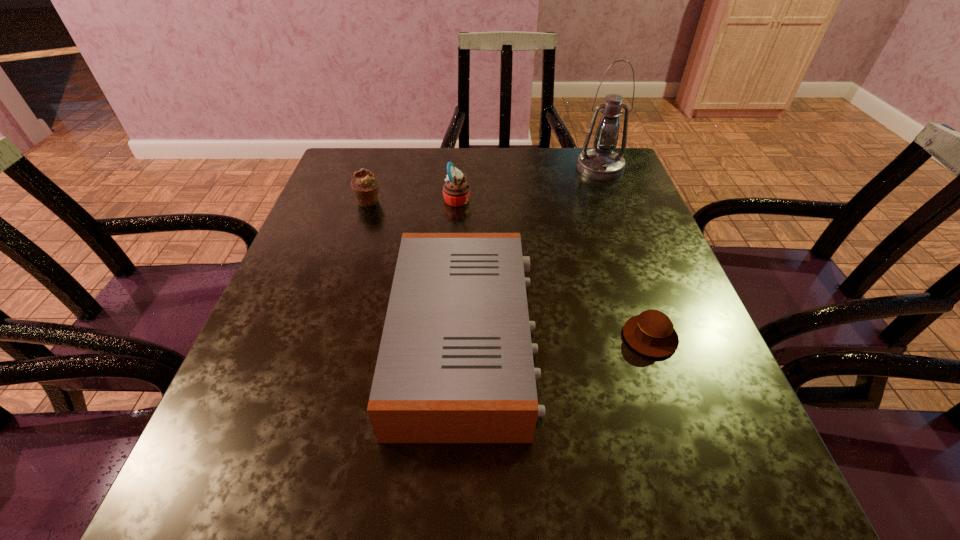
Identify the location of the tallest object. Image resolution: width=960 pixels, height=540 pixels. (602, 163).

This screenshot has width=960, height=540. I want to click on oil lamp, so click(602, 163).

Find the location of `the second muffin from right to left`. the second muffin from right to left is located at coordinates (456, 191).

Image resolution: width=960 pixels, height=540 pixels. Identify the location of the leftmost object. (365, 185).

Where is `radio receiver`? This screenshot has height=540, width=960. radio receiver is located at coordinates (455, 365).

Find the location of a particular element. Image resolution: width=960 pixels, height=540 pixels. the shortest object is located at coordinates (651, 333).

You are a GUI agent. You are given a task and a screenshot of the screen. Output one action in this format:
    pyautogui.click(x=<x>, y=<y>)
    Task: Click on the rightmost muffin
    
    Given the screenshot: What is the action you would take?
    pyautogui.click(x=651, y=333)

Identify the location of vacant space located 0.110m on the front of the tallest object. Image resolution: width=960 pixels, height=540 pixels. (613, 204).

Locate an element on the screen. The image size is (960, 540). vacant region located 0.400m on the front-facing side of the second muffin from left to right is located at coordinates (628, 199).

This screenshot has height=540, width=960. I want to click on vacant space situated on the front of the leftmost object, so click(x=350, y=260).